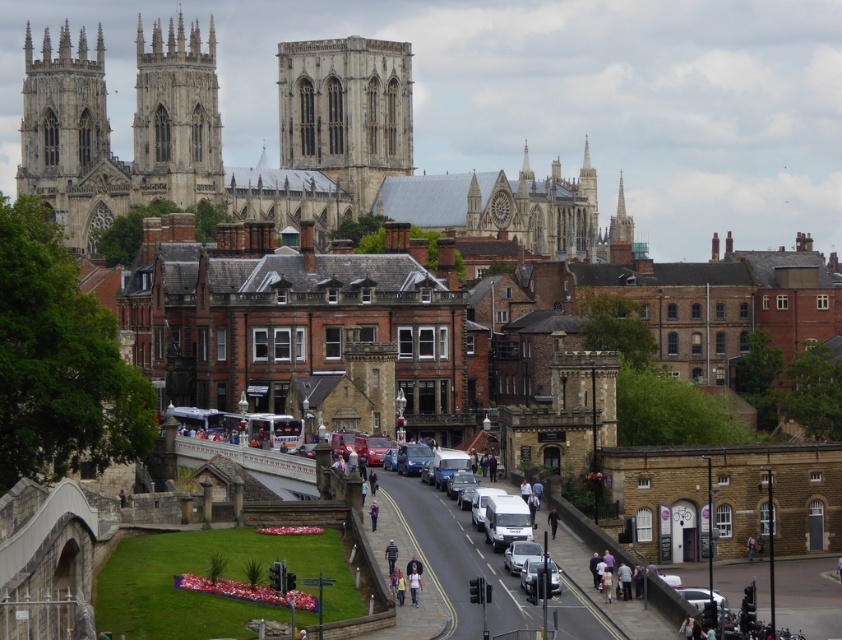
You are standing at the viewpoint of the image and want to know how far you are from the point labeled as point (680,589). Please state the distance in meters.

The distance between the viewer and point (680,589) is 70.72 meters.

You are a tourist standing at the center of the street in this urban scene. You want to take a photo of the grand cathedral in the background without any vehicles blocking the view. Is there a clear path to the cathedral from your current position? Please consider the metallic silver car at lower right located at point (695, 596).

The metallic silver car at lower right is located at point (695, 596). Since the cathedral is in the background and the car is at the lower right, it is likely positioned near the foreground. This means the car might be blocking the direct line of sight to the cathedral unless you move to a different angle or position.

You are a delivery person trying to park your metallic silver car at lower right in a parking spot that can only accommodate vehicles narrower than the purple fabric jacket at center. Can your car fit in the parking spot?

The metallic silver car at lower right is wider than the purple fabric jacket at center, so it cannot fit in the parking spot designed for narrower vehicles.